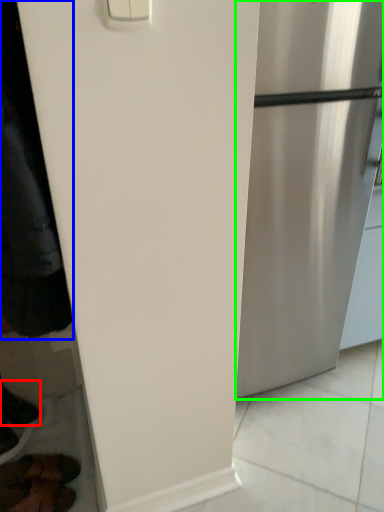
Question: Which object is positioned farthest from shoe (highlighted by a red box)? Select from jacket (highlighted by a blue box) and refrigerator (highlighted by a green box).

Choices:
 (A) jacket
 (B) refrigerator

Answer: (B)